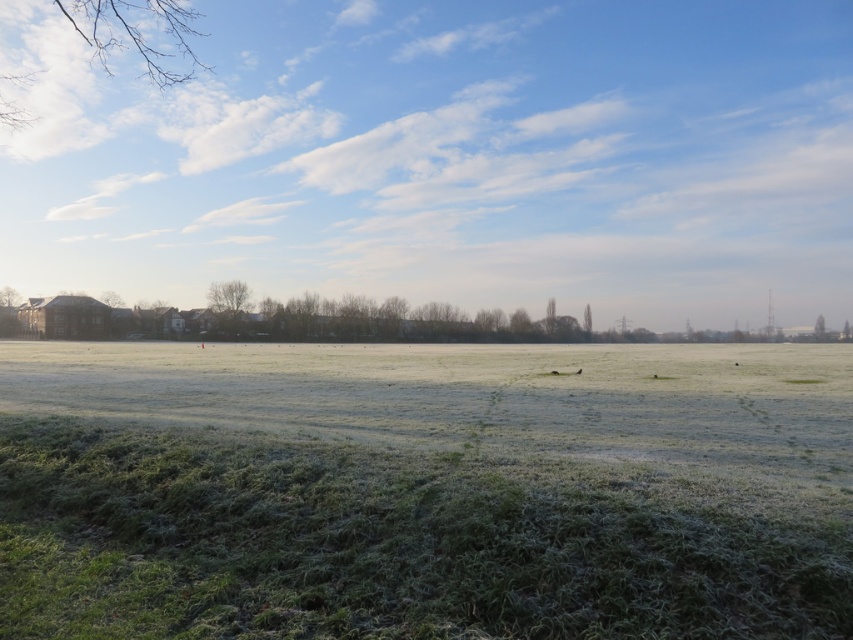
This screenshot has width=853, height=640. What do you see at coordinates (138, 35) in the screenshot?
I see `bare branches at upper left` at bounding box center [138, 35].

Between bare branches at upper left and green matte tree at right, which one is positioned lower?

green matte tree at right

I want to click on bare branches at upper left, so click(x=138, y=35).

Is green matte tree at left to the right of green matte tree at right from the viewer's perspective?

In fact, green matte tree at left is to the left of green matte tree at right.

Is green matte tree at left taller than green matte tree at right?

Incorrect, green matte tree at left's height is not larger of green matte tree at right's.

This screenshot has width=853, height=640. What are the coordinates of `green matte tree at left` in the screenshot? It's located at (111, 298).

Which is more to the right, bare branches at upper left or green matte tree at left?

green matte tree at left is more to the right.

Based on the photo, does bare branches at upper left appear over green matte tree at left?

Correct, bare branches at upper left is located above green matte tree at left.

At what (x,y) coordinates should I click in order to perform the action: click on bare branches at upper left. Please return your answer as a coordinate pair (x, y). Looking at the image, I should click on (138, 35).

At what (x,y) coordinates should I click in order to perform the action: click on bare branches at upper left. Please return your answer as a coordinate pair (x, y). This screenshot has height=640, width=853. Looking at the image, I should click on (138, 35).